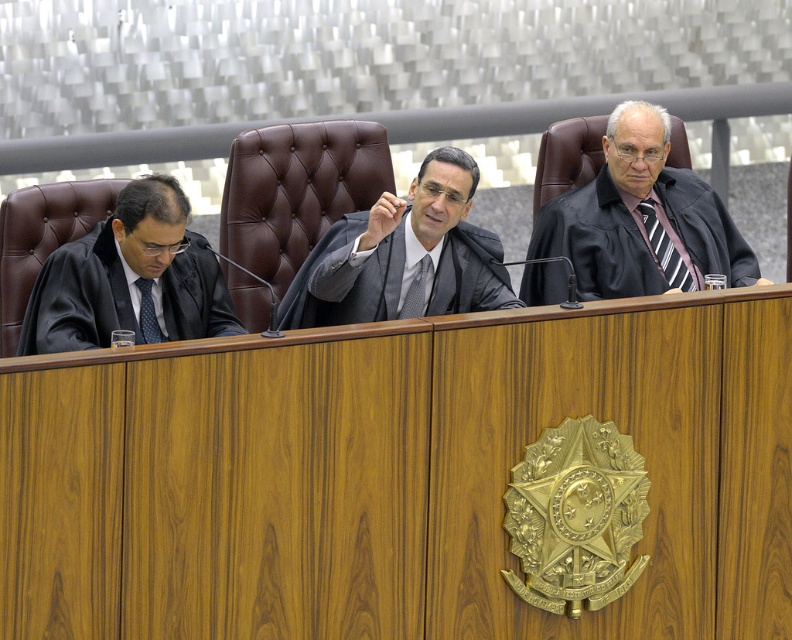
Can you confirm if black fabric robe at center is shorter than matte black robe at center?

Incorrect, black fabric robe at center's height does not fall short of matte black robe at center's.

Which is below, black fabric robe at center or matte black robe at center?

matte black robe at center is below.

Is point (718, 266) positioned after point (329, 253)?

Yes.

Identify the location of black fabric robe at center. The image size is (792, 640). (598, 241).

Does matte black robe at center have a larger size compared to black matte robe at left?

Indeed, matte black robe at center has a larger size compared to black matte robe at left.

Locate an element on the screen. matte black robe at center is located at coordinates coord(345,278).

Where is `matte black robe at center`? matte black robe at center is located at coordinates (345, 278).

Who is shorter, black fabric robe at center or black matte robe at left?

black matte robe at left

Between black fabric robe at center and black matte robe at left, which one is positioned lower?

black matte robe at left is lower down.

The width and height of the screenshot is (792, 640). In order to click on black fabric robe at center in this screenshot , I will do `click(598, 241)`.

The height and width of the screenshot is (640, 792). I want to click on black fabric robe at center, so click(x=598, y=241).